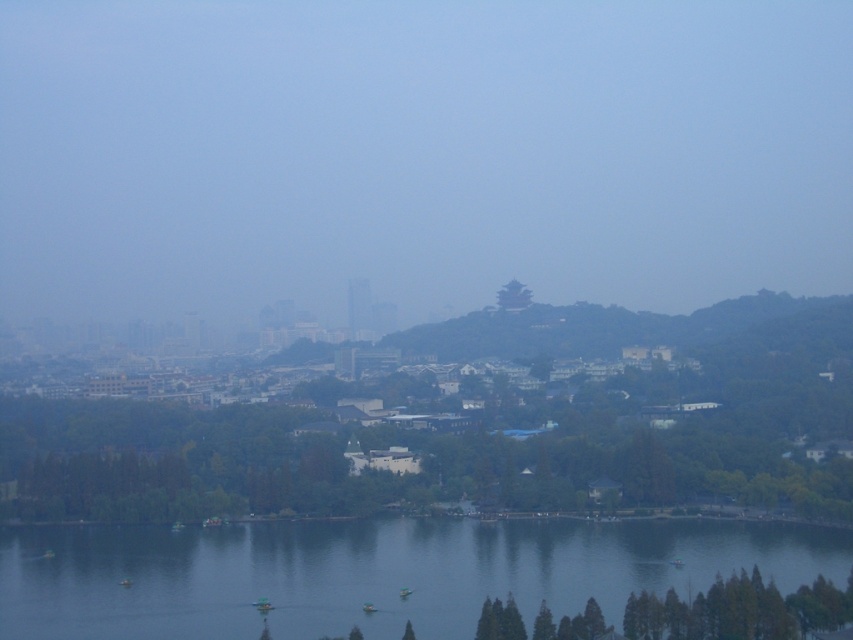
Where is `clear blue water at lower center`? Image resolution: width=853 pixels, height=640 pixels. clear blue water at lower center is located at coordinates (375, 572).

Is clear blue water at lower center thinner than green matte pagoda at center?

No.

Who is more distant from viewer, (x=27, y=614) or (x=515, y=289)?

Positioned behind is point (x=515, y=289).

I want to click on clear blue water at lower center, so click(x=375, y=572).

Does green matte tree at center lie in front of green matte pagoda at center?

Yes, green matte tree at center is closer to the viewer.

Which of these two, green matte tree at center or green matte pagoda at center, stands shorter?

Standing shorter between the two is green matte pagoda at center.

Which is behind, point (634, 388) or point (509, 301)?

The point (509, 301) is more distant.

The image size is (853, 640). I want to click on green matte tree at center, so click(x=469, y=419).

Between green matte tree at center and clear blue water at lower center, which one is positioned lower?

Positioned lower is clear blue water at lower center.

Does green matte tree at center have a smaller size compared to clear blue water at lower center?

Actually, green matte tree at center might be larger than clear blue water at lower center.

Between point (93, 518) and point (379, 580), which one is positioned behind?

Positioned behind is point (93, 518).

The width and height of the screenshot is (853, 640). What are the coordinates of `green matte tree at center` in the screenshot? It's located at (469, 419).